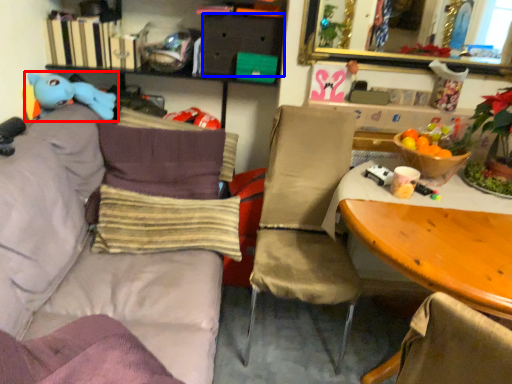
Question: Which of the following is the farthest to the observer, toy (highlighted by a red box) or drawer (highlighted by a blue box)?

Choices:
 (A) toy
 (B) drawer

Answer: (B)